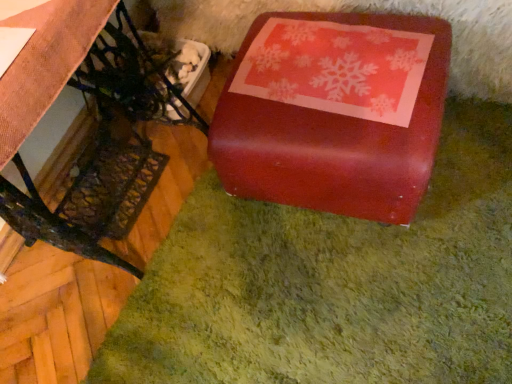
Question: Considering the positions of shiny red box at right and glossy red box at center in the image, is shiny red box at right taller or shorter than glossy red box at center?

Choices:
 (A) short
 (B) tall

Answer: (B)

Question: From a real-world perspective, is shiny red box at right above or below glossy red box at center?

Choices:
 (A) above
 (B) below

Answer: (A)

Question: Do you think shiny red box at right is within glossy red box at center, or outside of it?

Choices:
 (A) outside
 (B) inside

Answer: (A)

Question: Is point (385, 31) positioned closer to the camera than point (122, 89)?

Choices:
 (A) closer
 (B) farther

Answer: (A)

Question: From the image's perspective, relative to shiny red box at right, is glossy red box at center above or below?

Choices:
 (A) below
 (B) above

Answer: (B)

Question: Considering the positions of glossy red box at center and shiny red box at right in the image, is glossy red box at center taller or shorter than shiny red box at right?

Choices:
 (A) short
 (B) tall

Answer: (A)

Question: Considering their positions, is glossy red box at center located in front of or behind shiny red box at right?

Choices:
 (A) behind
 (B) front

Answer: (A)